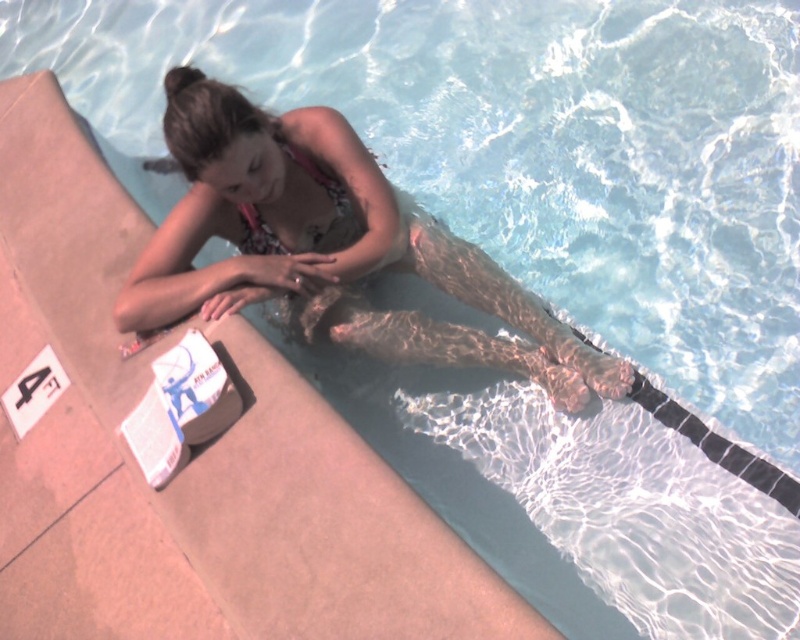
Consider the image. Is floral bikini at center above patterned fabric bikini top at upper center?

Actually, floral bikini at center is below patterned fabric bikini top at upper center.

Which is below, floral bikini at center or patterned fabric bikini top at upper center?

floral bikini at center is below.

What do you see at coordinates (330, 248) in the screenshot? I see `floral bikini at center` at bounding box center [330, 248].

Identify the location of floral bikini at center. (330, 248).